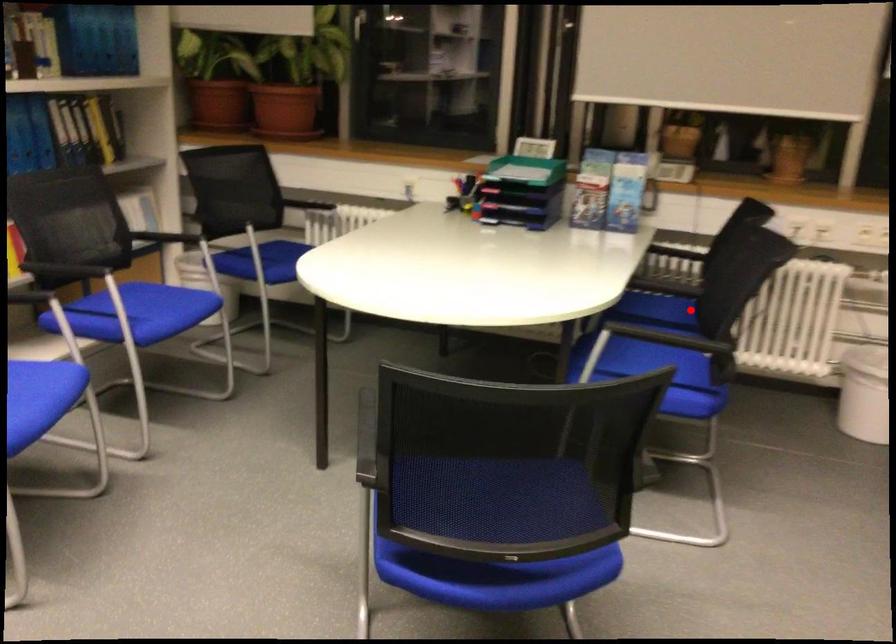
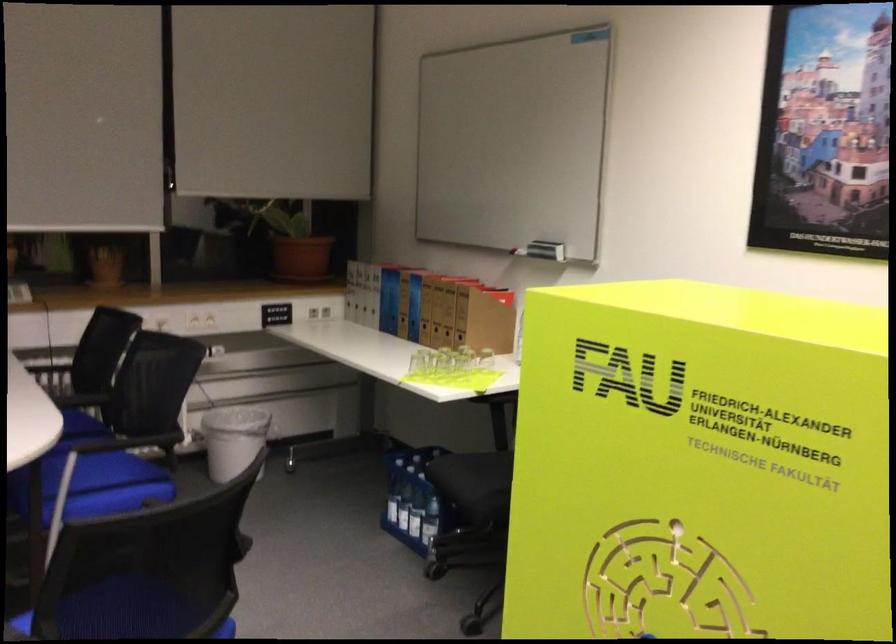
In the second image, find the point that corresponds to the highlighted location in the first image.

(81, 424)